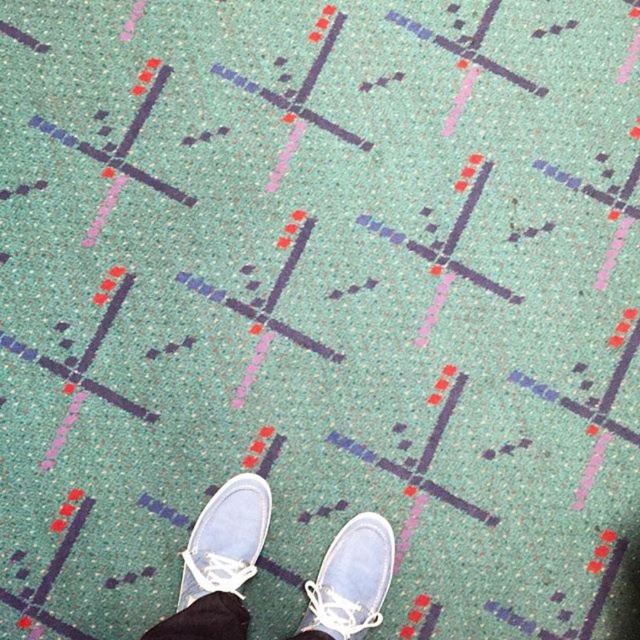
Is white canvas shoes at center above white canvas shoe at center?

No, white canvas shoes at center is not above white canvas shoe at center.

Which is more to the right, white canvas shoes at center or white canvas shoe at center?

From the viewer's perspective, white canvas shoes at center appears more on the right side.

Who is more distant from viewer, (209, 628) or (234, 499)?

The point (234, 499) is behind.

Where is `white canvas shoes at center`? This screenshot has height=640, width=640. white canvas shoes at center is located at coordinates (220, 563).

Locate an element on the screen. This screenshot has height=640, width=640. white canvas shoes at center is located at coordinates (220, 563).

In order to click on white canvas shoes at center in this screenshot , I will do `click(220, 563)`.

Is white suede shoe at lower center closer to the viewer compared to white canvas shoe at center?

Yes.

Can you confirm if white suede shoe at lower center is positioned above white canvas shoe at center?

No.

In order to click on white suede shoe at lower center in this screenshot , I will do `click(352, 579)`.